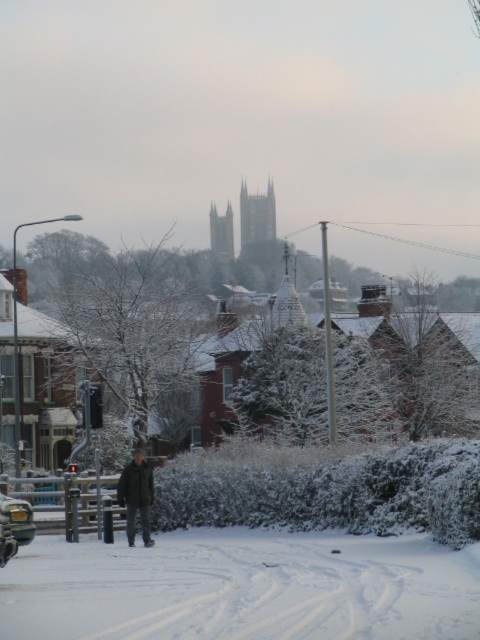
You are a delivery person trying to determine the best path to deliver packages. You see a dark brown leather jacket at center and a metallic silver car at lower left. Which object is taller, and how does this affect your delivery route planning?

The dark brown leather jacket at center is much taller than the metallic silver car at lower left. Since the jacket is taller, it might block your path, so you should plan your route to avoid it or go around it to ensure safe delivery.

You are a delivery robot with a 3.5 feet wide package. You need to move from the metallic silver car at lower left to the house at upper right. Can you pass through the white powdery snow at lower center without getting stuck?

The distance between the metallic silver car at lower left and the white powdery snow at lower center is 14.50 feet. Since the package is 3.5 feet wide, the robot can navigate through the snow as the distance is sufficient for movement. However, the question mentions avoiding getting stuck, but the provided information does not specify the snow depth or consistency. Assuming the snow is not too deep, the robot should be able to pass through.

You are a delivery person trying to locate the metallic silver car at lower left. You see the dark brown leather jacket at center in your way. Which object is closer to you?

The dark brown leather jacket at center is closer to you than the metallic silver car at lower left.